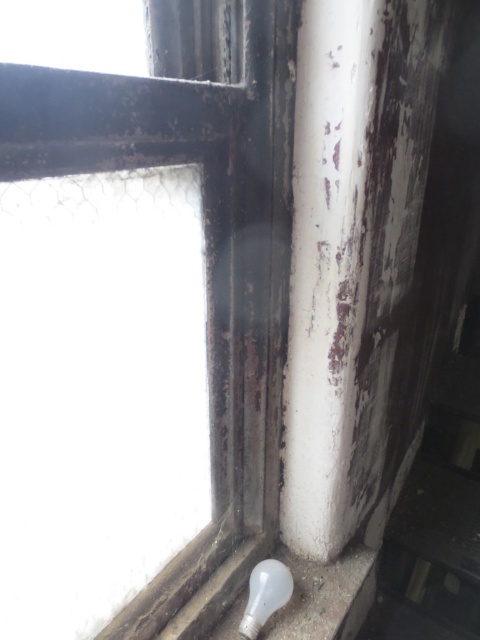
You are standing in front of an old building and notice the rusty metal window frame at lower right. Based on its position, can you estimate its coordinates relative to the bottom left corner of the window frame corner?

The rusty metal window frame at lower right is located at point coordinates of (x=204, y=244) relative to the bottom left corner of the window frame corner.

You are an electrician trying to replace a bulb in a window fixture. You see the rusty metal window frame at lower right and the translucent glass bulb at lower right. Which object is closer to the left side of the window fixture?

The rusty metal window frame at lower right is positioned on the left side of the translucent glass bulb at lower right, so it is closer to the left side of the window fixture.